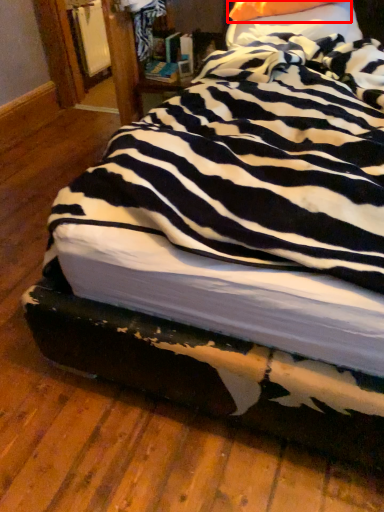
Question: From the image's perspective, what is the correct spatial relationship of pillow (annotated by the red box) in relation to pillow?

Choices:
 (A) above
 (B) below

Answer: (A)